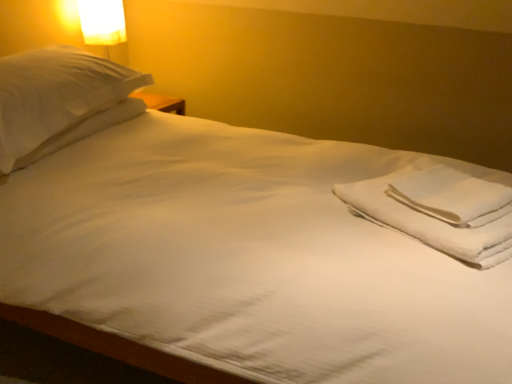
Question: Considering the relative sizes of white cotton towels at right and matte white lampshade at upper left in the image provided, is white cotton towels at right smaller than matte white lampshade at upper left?

Choices:
 (A) no
 (B) yes

Answer: (B)

Question: Does white cotton towels at right appear on the right side of matte white lampshade at upper left?

Choices:
 (A) yes
 (B) no

Answer: (A)

Question: Does white cotton towels at right touch matte white lampshade at upper left?

Choices:
 (A) yes
 (B) no

Answer: (B)

Question: Is the position of white cotton towels at right more distant than that of matte white lampshade at upper left?

Choices:
 (A) no
 (B) yes

Answer: (A)

Question: Is there a large distance between white cotton towels at right and matte white lampshade at upper left?

Choices:
 (A) yes
 (B) no

Answer: (A)

Question: Is matte white lampshade at upper left located within white cotton towels at right?

Choices:
 (A) no
 (B) yes

Answer: (A)

Question: Is the position of matte white lampshade at upper left more distant than that of white cotton towels at right?

Choices:
 (A) yes
 (B) no

Answer: (A)

Question: Is white cotton towels at right surrounded by matte white lampshade at upper left?

Choices:
 (A) no
 (B) yes

Answer: (A)

Question: Can we say matte white lampshade at upper left lies outside white cotton towels at right?

Choices:
 (A) no
 (B) yes

Answer: (B)

Question: From a real-world perspective, is matte white lampshade at upper left on white cotton towels at right?

Choices:
 (A) no
 (B) yes

Answer: (B)

Question: From a real-world perspective, is matte white lampshade at upper left below white cotton towels at right?

Choices:
 (A) yes
 (B) no

Answer: (B)

Question: From the image's perspective, is matte white lampshade at upper left on white cotton towels at right?

Choices:
 (A) yes
 (B) no

Answer: (A)

Question: From a real-world perspective, is matte white lampshade at upper left on top of white soft towel at right?

Choices:
 (A) yes
 (B) no

Answer: (A)